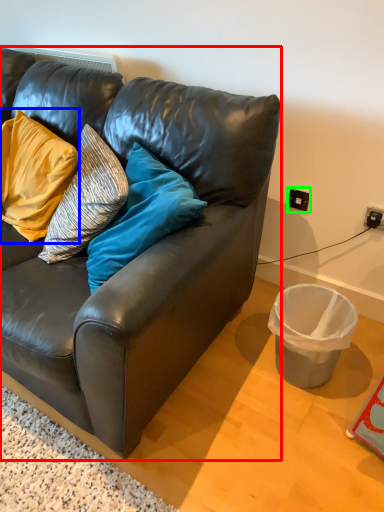
Question: Which object is positioned farthest from studio couch (highlighted by a red box)? Select from pillow (highlighted by a blue box) and power outlet (highlighted by a green box).

Choices:
 (A) pillow
 (B) power outlet

Answer: (B)